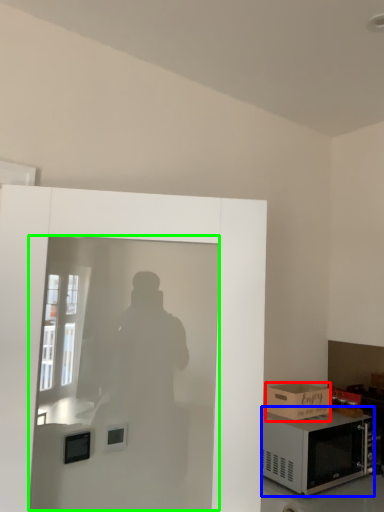
Question: Considering the real-world distances, which object is closest to box (highlighted by a red box)? microwave oven (highlighted by a blue box) or screen door (highlighted by a green box).

Choices:
 (A) microwave oven
 (B) screen door

Answer: (A)